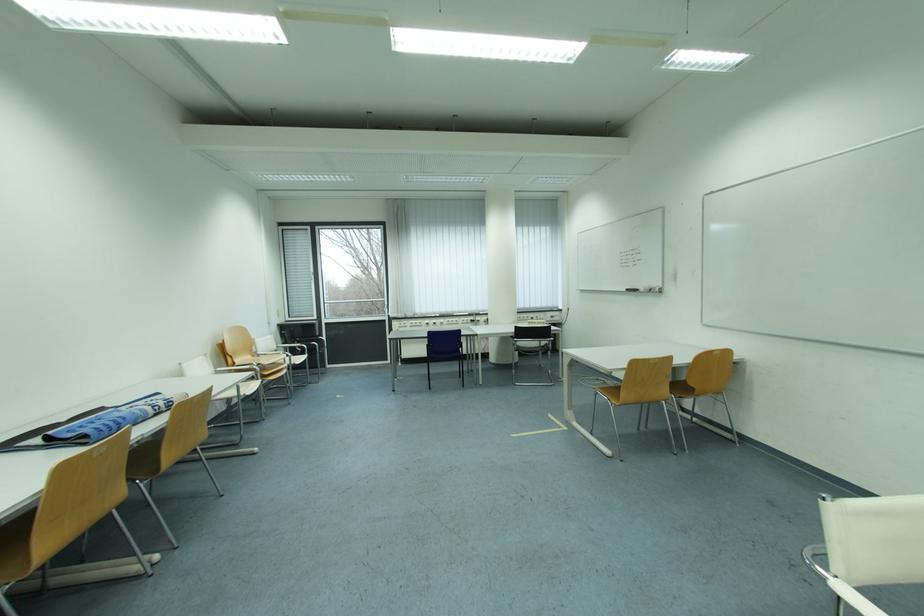
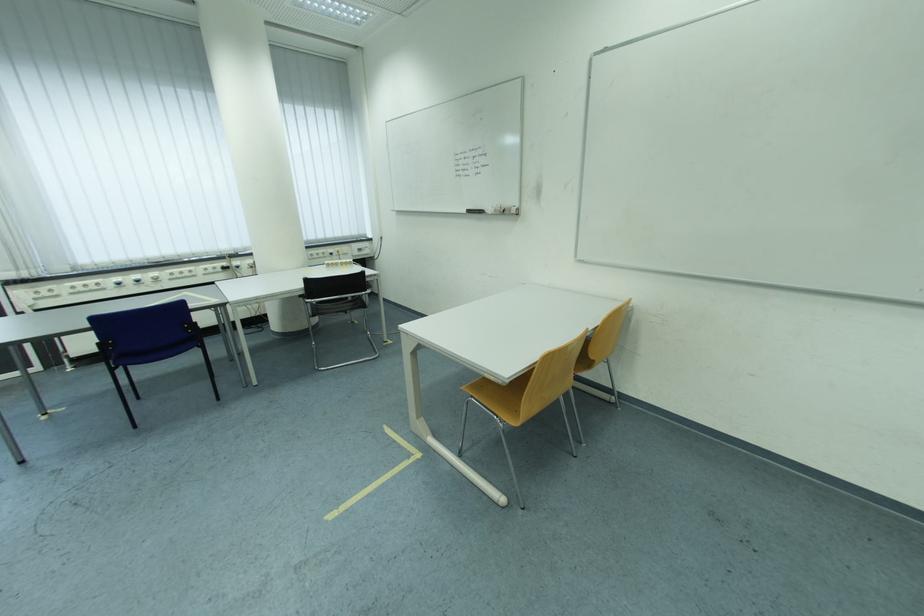
Locate, in the second image, the point that corresponds to (636,292) in the first image.

(476, 213)